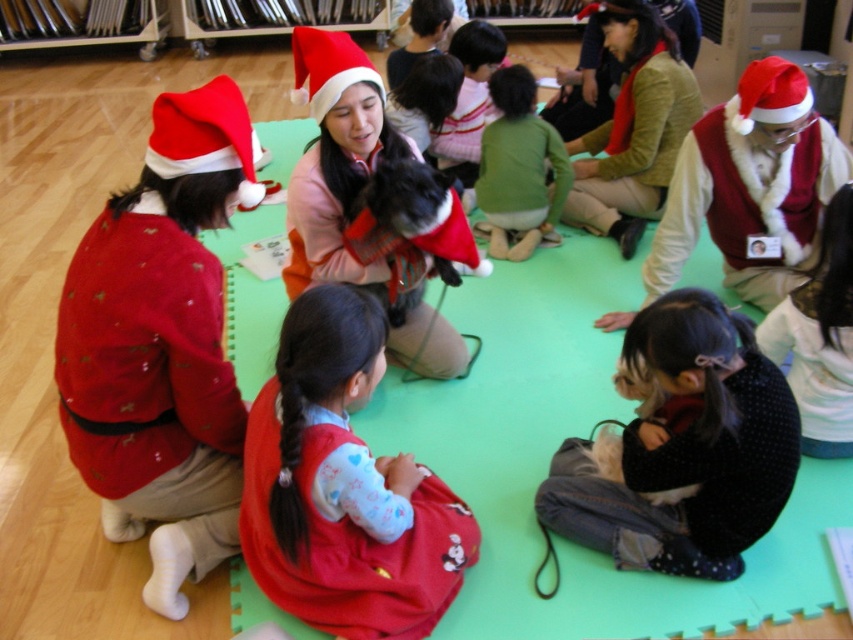
Question: Which object is positioned farthest from the velvet red vest at upper right?

Choices:
 (A) matte red sweater at left
 (B) matte red sweater at center
 (C) green fleece jacket at center

Answer: (A)

Question: From the image, what is the correct spatial relationship of matte red sweater at center in relation to green fleece jacket at center?

Choices:
 (A) above
 (B) below

Answer: (B)

Question: Is matte red sweater at center to the left of green fleece jacket at center from the viewer's perspective?

Choices:
 (A) yes
 (B) no

Answer: (A)

Question: Does matte red sweater at left appear on the right side of matte red sweater at center?

Choices:
 (A) no
 (B) yes

Answer: (A)

Question: Considering the real-world distances, which object is farthest from the green fleece jacket at center?

Choices:
 (A) velvet red vest at upper right
 (B) matte red sweater at center
 (C) matte red sweater at left

Answer: (C)

Question: Estimate the real-world distances between objects in this image. Which object is closer to the green fleece jacket at center?

Choices:
 (A) velvet red vest at upper right
 (B) matte red sweater at left
 (C) matte red sweater at center

Answer: (A)